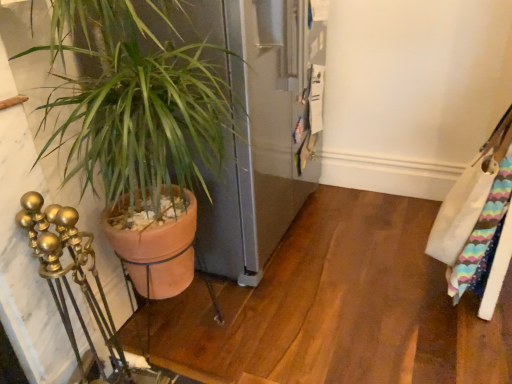
Find the location of a particular element. The width and height of the screenshot is (512, 384). white fabric messenger bag at right is located at coordinates (469, 197).

What do you see at coordinates (469, 197) in the screenshot?
I see `white fabric messenger bag at right` at bounding box center [469, 197].

Measure the distance between point (168, 55) and camera.

38.86 inches.

You are a GUI agent. You are given a task and a screenshot of the screen. Output one action in this format:
    pyautogui.click(x=<x>, y=<y>)
    Task: Click on the terracotta pot at left
    This screenshot has width=512, height=384.
    Given the screenshot: What is the action you would take?
    pyautogui.click(x=135, y=104)

This screenshot has height=384, width=512. Describe the element at coordinates (135, 104) in the screenshot. I see `terracotta pot at left` at that location.

Find the location of a particular element. The width and height of the screenshot is (512, 384). white fabric messenger bag at right is located at coordinates (469, 197).

Looking at this image, would you say terracotta pot at left is to the left or to the right of white fabric messenger bag at right in the picture?

In the image, terracotta pot at left appears on the left side of white fabric messenger bag at right.

From the picture: Is the depth of terracotta pot at left less than that of white fabric messenger bag at right?

Yes, terracotta pot at left is closer to the viewer.

Which is closer, [195,72] or [511,143]?

Point [195,72] is closer to the camera than point [511,143].

From the image's perspective, is terracotta pot at left beneath white fabric messenger bag at right?

Yes, from the image's perspective, terracotta pot at left is below white fabric messenger bag at right.

From a real-world perspective, which is physically above, terracotta pot at left or white fabric messenger bag at right?

In real-world perspective, terracotta pot at left is above.

Between terracotta pot at left and white fabric messenger bag at right, which one has larger width?

terracotta pot at left is wider.

Looking at this image, which of these two, terracotta pot at left or white fabric messenger bag at right, stands taller?

terracotta pot at left.

Which of these two, terracotta pot at left or white fabric messenger bag at right, is smaller?

Smaller between the two is white fabric messenger bag at right.

Is terracotta pot at left situated inside white fabric messenger bag at right or outside?

The correct answer is: outside.

In the scene shown: Would you say terracotta pot at left is a long distance from white fabric messenger bag at right?

No, terracotta pot at left is not far away from white fabric messenger bag at right.

Could you tell me if terracotta pot at left is turned towards white fabric messenger bag at right?

No.

How different are the orientations of terracotta pot at left and white fabric messenger bag at right in degrees?

The angular difference between terracotta pot at left and white fabric messenger bag at right is 95.3 degrees.

Locate an element on the screen. This screenshot has width=512, height=384. houseplant lying on the left of white fabric messenger bag at right is located at coordinates (135, 104).

Is white fabric messenger bag at right to the left of terracotta pot at left from the viewer's perspective?

Incorrect, white fabric messenger bag at right is not on the left side of terracotta pot at left.

Which is behind, white fabric messenger bag at right or terracotta pot at left?

white fabric messenger bag at right is further from the camera.

Is point (438, 223) positioned after point (97, 143)?

Yes, it is.

From the image's perspective, which object appears higher, white fabric messenger bag at right or terracotta pot at left?

white fabric messenger bag at right, from the image's perspective.

In the scene shown: From a real-world perspective, is white fabric messenger bag at right beneath terracotta pot at left?

Correct, in the physical world, white fabric messenger bag at right is lower than terracotta pot at left.

Considering the relative sizes of white fabric messenger bag at right and terracotta pot at left in the image provided, is white fabric messenger bag at right thinner than terracotta pot at left?

Yes, white fabric messenger bag at right is thinner than terracotta pot at left.

Between white fabric messenger bag at right and terracotta pot at left, which one has more height?

terracotta pot at left.

Looking at the image, does white fabric messenger bag at right seem bigger or smaller compared to terracotta pot at left?

white fabric messenger bag at right is smaller than terracotta pot at left.

Choose the correct answer: Is white fabric messenger bag at right inside terracotta pot at left or outside it?

white fabric messenger bag at right cannot be found inside terracotta pot at left.

Is white fabric messenger bag at right directly adjacent to terracotta pot at left?

No, white fabric messenger bag at right is not with terracotta pot at left.

Could you tell me if white fabric messenger bag at right is facing terracotta pot at left?

No, white fabric messenger bag at right is not facing towards terracotta pot at left.

Consider the image. Can you tell me how much white fabric messenger bag at right and terracotta pot at left differ in facing direction?

The angle between the facing direction of white fabric messenger bag at right and the facing direction of terracotta pot at left is 95.3 degrees.

Identify the location of messenger bag located above the terracotta pot at left (from the image's perspective). The width and height of the screenshot is (512, 384). (469, 197).

The height and width of the screenshot is (384, 512). Find the location of `houseplant located on the left of white fabric messenger bag at right`. houseplant located on the left of white fabric messenger bag at right is located at coordinates tap(135, 104).

The height and width of the screenshot is (384, 512). I want to click on houseplant below the white fabric messenger bag at right (from the image's perspective), so click(135, 104).